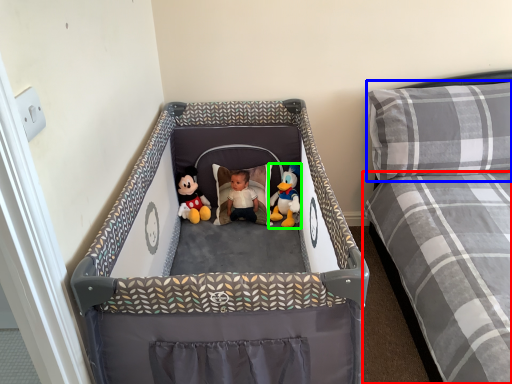
Question: Estimate the real-world distances between objects in this image. Which object is farther from mattress (highlighted by a red box), pillow (highlighted by a blue box) or toy (highlighted by a green box)?

Choices:
 (A) pillow
 (B) toy

Answer: (B)